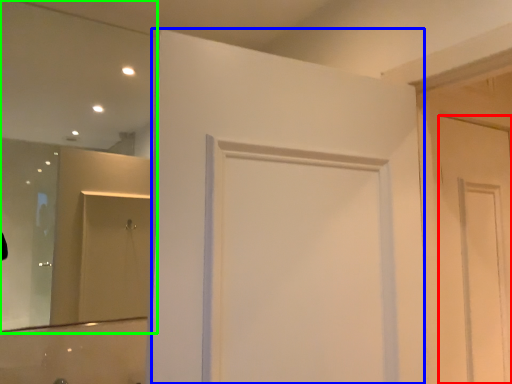
Question: Based on their relative distances, which object is nearer to door (highlighted by a red box)? Choose from door (highlighted by a blue box) and mirror (highlighted by a green box).

Choices:
 (A) door
 (B) mirror

Answer: (A)